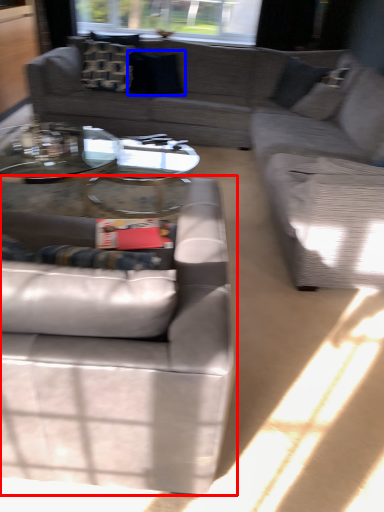
Question: Which point is further to the camera, studio couch (highlighted by a red box) or pillow (highlighted by a blue box)?

Choices:
 (A) studio couch
 (B) pillow

Answer: (B)